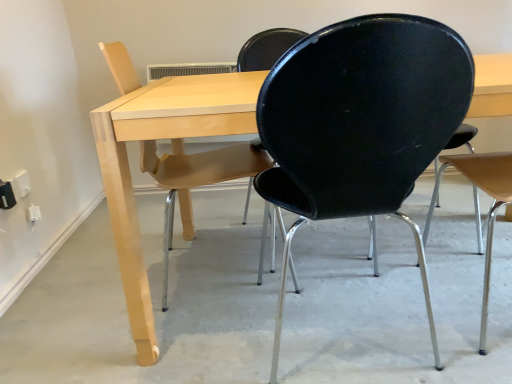
Where is `free space behind matte wood chair at left, which appears as the first chair when viewed from the left`? free space behind matte wood chair at left, which appears as the first chair when viewed from the left is located at coordinates (214, 238).